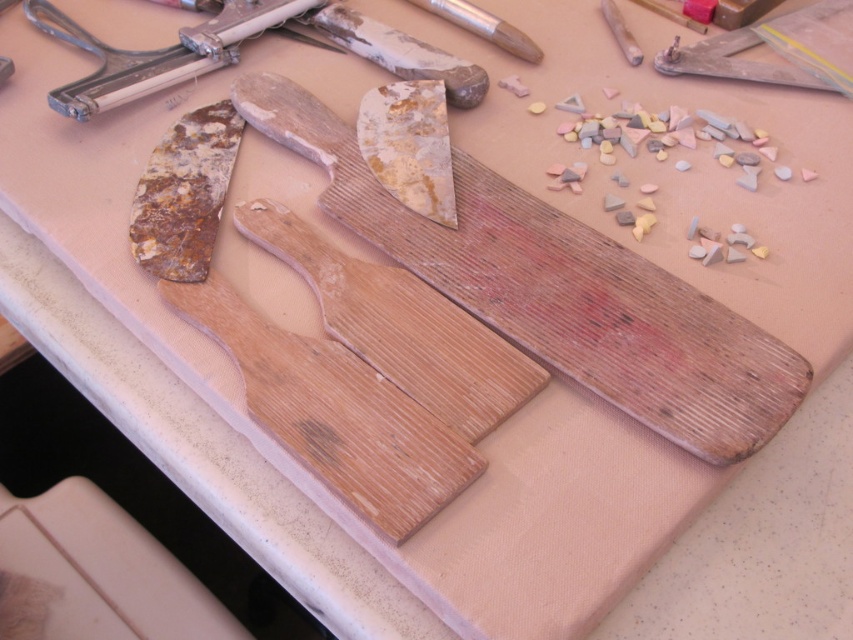
Question: Based on their relative distances, which object is nearer to the wooden plank at center?

Choices:
 (A) metallic silver tool at upper left
 (B) wooden cutting board at center

Answer: (B)

Question: Which object is farther from the camera taking this photo?

Choices:
 (A) wooden plank at center
 (B) metallic silver tool at upper left
 (C) wooden cutting board at center

Answer: (B)

Question: Which of these objects is positioned farthest from the metallic silver tool at upper left?

Choices:
 (A) wooden plank at center
 (B) wooden cutting board at center

Answer: (A)

Question: Is wooden cutting board at center closer to camera compared to metallic silver tool at upper left?

Choices:
 (A) yes
 (B) no

Answer: (A)

Question: Can you confirm if wooden cutting board at center is positioned to the right of metallic silver tool at upper left?

Choices:
 (A) yes
 (B) no

Answer: (A)

Question: Does wooden cutting board at center lie in front of wooden plank at center?

Choices:
 (A) no
 (B) yes

Answer: (B)